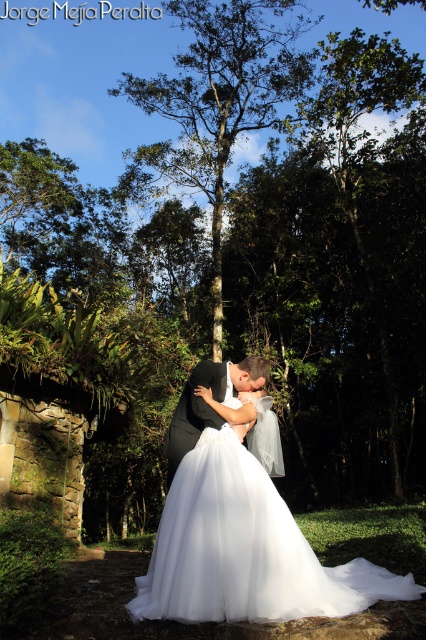
Question: Can you confirm if white tulle dress at center is positioned above black satin suit at center?

Choices:
 (A) yes
 (B) no

Answer: (B)

Question: Among these points, which one is nearest to the camera?

Choices:
 (A) click(187, 584)
 (B) click(215, 104)
 (C) click(189, 416)

Answer: (A)

Question: Does white tulle dress at center appear over green leafy tree at center?

Choices:
 (A) yes
 (B) no

Answer: (B)

Question: Can you confirm if white tulle dress at center is positioned above green leafy tree at center?

Choices:
 (A) yes
 (B) no

Answer: (B)

Question: Which object is positioned farthest from the green leafy tree at center?

Choices:
 (A) black satin suit at center
 (B) white tulle dress at center

Answer: (A)

Question: Which point is farther from the camera taking this photo?

Choices:
 (A) (169, 496)
 (B) (166, 481)
 (C) (212, 250)

Answer: (C)